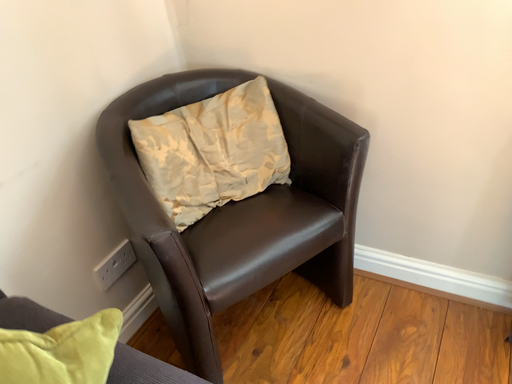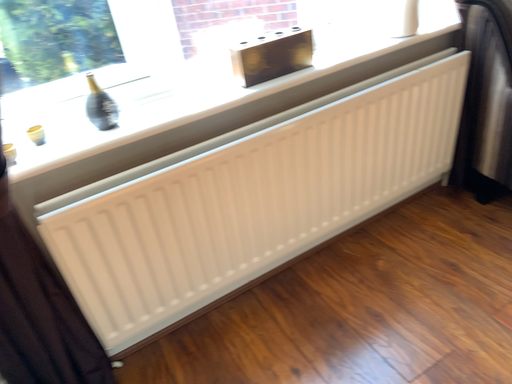
Question: Which way did the camera rotate in the video?

Choices:
 (A) rotated left
 (B) rotated right

Answer: (B)